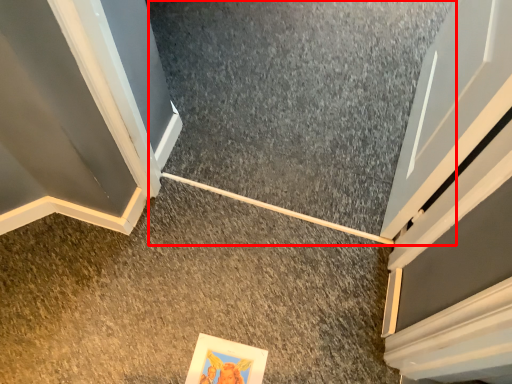
Question: From the image's perspective, where is concrete (annotated by the red box) located in relation to concrete in the image?

Choices:
 (A) above
 (B) below

Answer: (A)